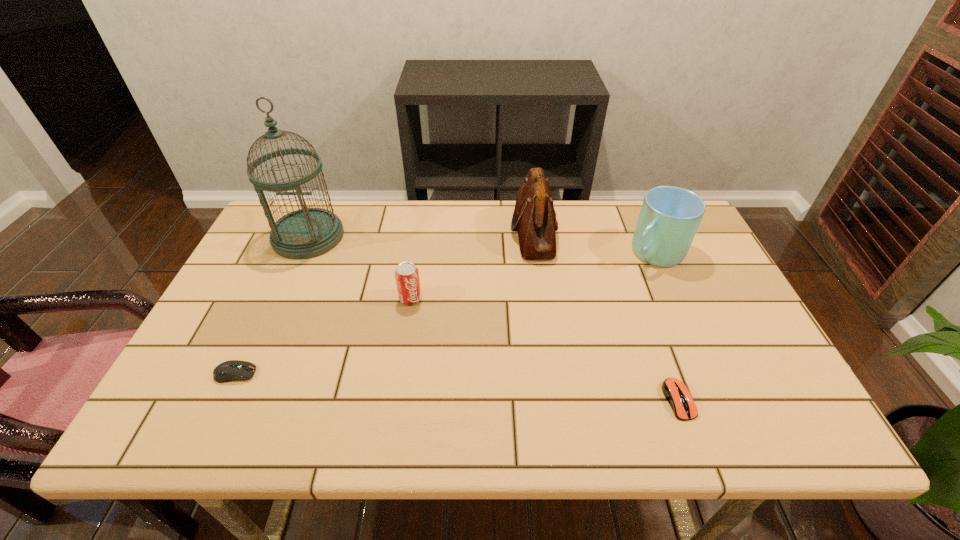
Where is `computer equipment that is positioned at the left edge`? computer equipment that is positioned at the left edge is located at coordinates (233, 370).

The image size is (960, 540). What are the coordinates of `object positioned at the right edge` in the screenshot? It's located at (670, 216).

The image size is (960, 540). In order to click on object situated at the far left corner in this screenshot , I will do `click(308, 232)`.

At what (x,y) coordinates should I click in order to perform the action: click on object situated at the far right corner. Please return your answer as a coordinate pair (x, y). Image resolution: width=960 pixels, height=540 pixels. Looking at the image, I should click on (670, 216).

Find the location of a particular element. This screenshot has height=540, width=960. free space at the far edge of the desktop is located at coordinates (393, 232).

Locate an element on the screen. Image resolution: width=960 pixels, height=540 pixels. blank space at the near edge of the desktop is located at coordinates (714, 438).

Where is `vacant region at the left edge of the desktop`? The height and width of the screenshot is (540, 960). vacant region at the left edge of the desktop is located at coordinates (269, 295).

This screenshot has width=960, height=540. I want to click on free space at the right edge of the desktop, so click(x=671, y=270).

Locate an element on the screen. This screenshot has width=960, height=540. vacant space at the near right corner of the desktop is located at coordinates (788, 404).

Find the location of a particular element. The image size is (960, 540). vacant region between the fifth shortest object and the fourth shortest object is located at coordinates (594, 242).